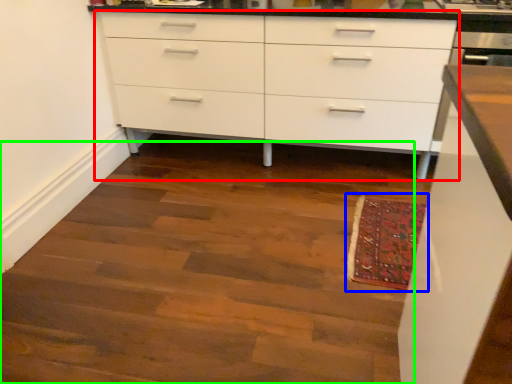
Question: Which is nearer to the chest of drawers (highlighted by a red box)? mat (highlighted by a blue box) or stairwell (highlighted by a green box).

Choices:
 (A) mat
 (B) stairwell

Answer: (B)